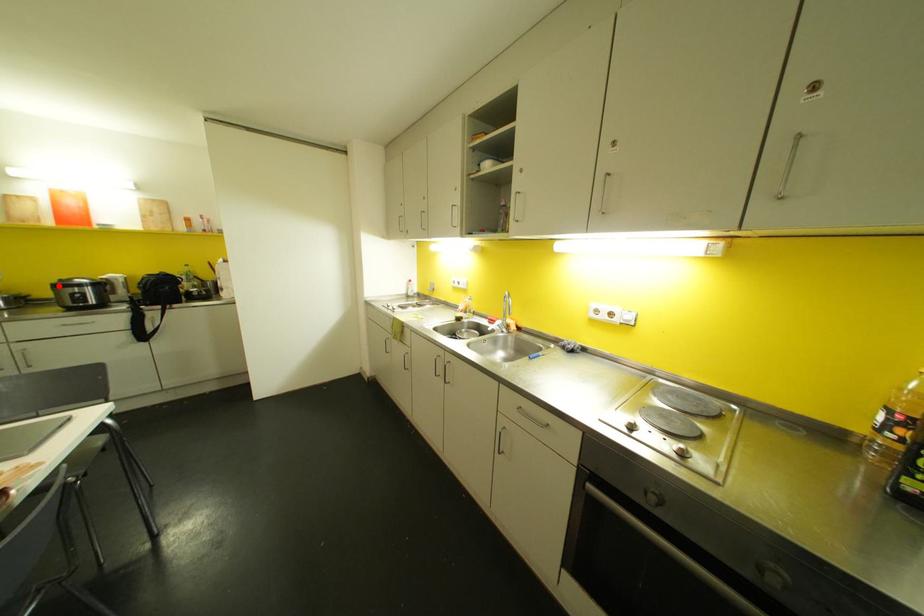
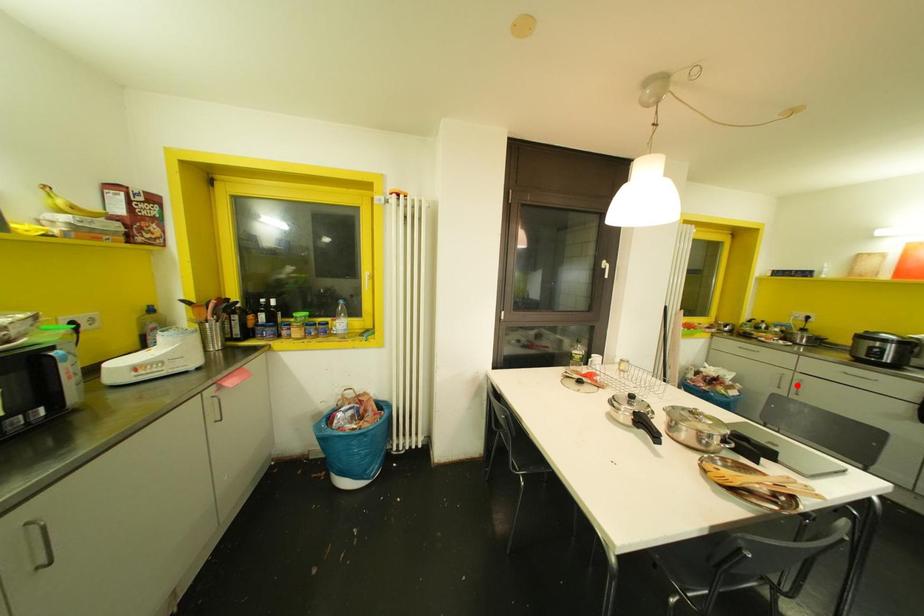
I am providing you with two images of the same scene from different viewpoints. A red point is marked on the first image and another point is marked on the second image. Are the points marked in image1 and image2 representing the same 3D position?

No